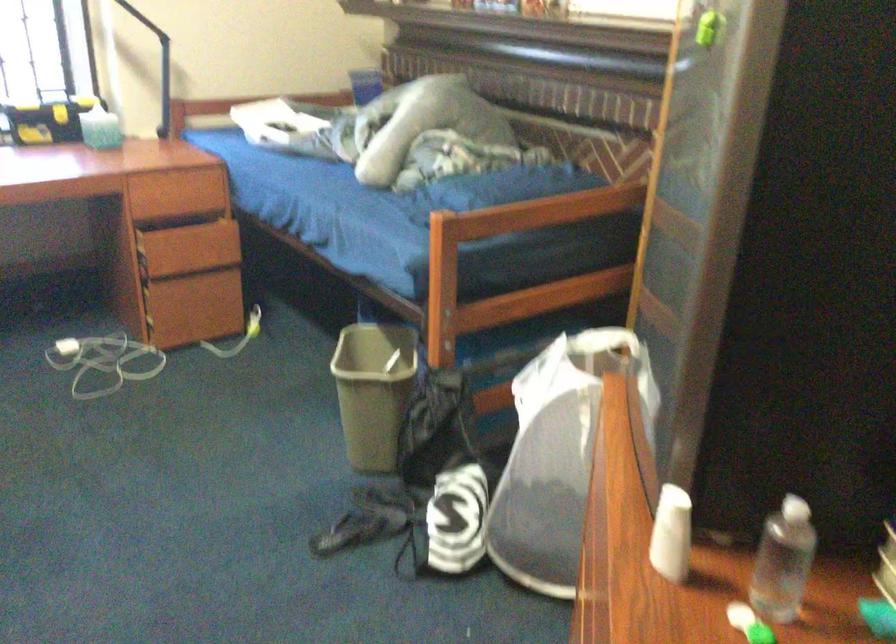
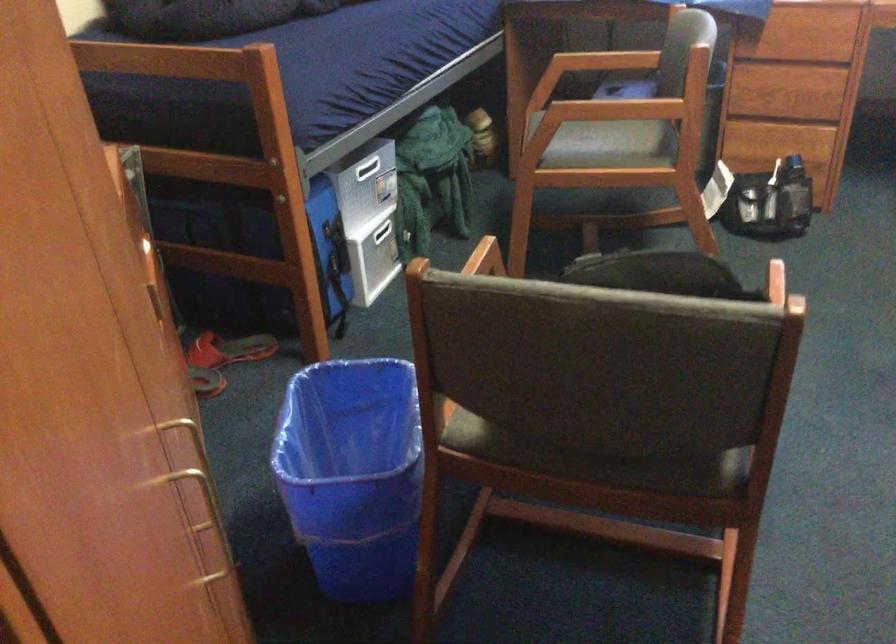
The images are taken continuously from a first-person perspective. In which direction is your viewpoint rotating?

The camera's rotation is toward left-down.